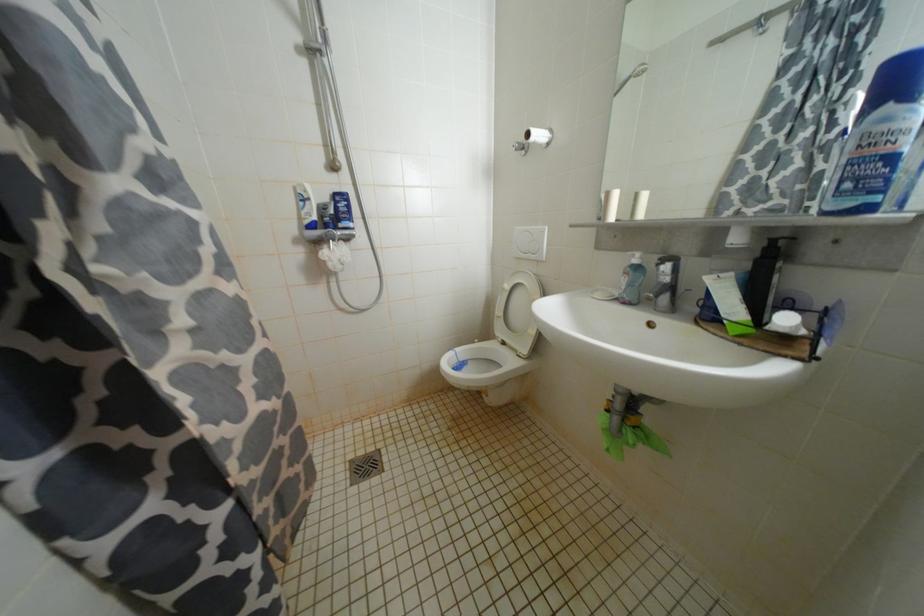
Describe the element at coordinates (528, 245) in the screenshot. I see `a toilet flush button` at that location.